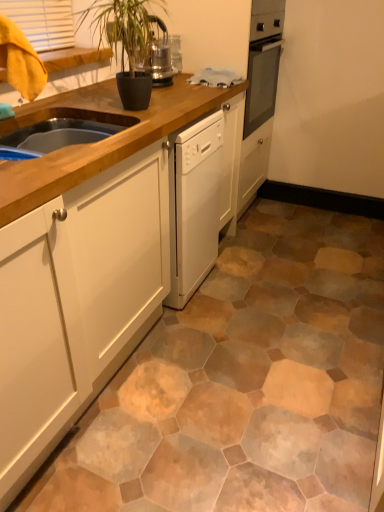
This screenshot has height=512, width=384. Find the location of `dark green glossy plant at upper center`. dark green glossy plant at upper center is located at coordinates (127, 31).

Describe the element at coordinates (127, 31) in the screenshot. The height and width of the screenshot is (512, 384). I see `dark green glossy plant at upper center` at that location.

The width and height of the screenshot is (384, 512). What are the coordinates of `white matte cabinet at center` in the screenshot? It's located at (82, 260).

Measure the distance between white matte cabinet at center and camera.

36.18 inches.

Describe the element at coordinates (82, 260) in the screenshot. This screenshot has width=384, height=512. I see `white matte cabinet at center` at that location.

The height and width of the screenshot is (512, 384). I want to click on dark green glossy plant at upper center, so click(127, 31).

Considering the relative positions of white matte cabinet at center and dark green glossy plant at upper center in the image provided, is white matte cabinet at center to the left or to the right of dark green glossy plant at upper center?

From the image, it's evident that white matte cabinet at center is to the left of dark green glossy plant at upper center.

Which object is further away from the camera, white matte cabinet at center or dark green glossy plant at upper center?

dark green glossy plant at upper center.

Is point (39, 418) farther from viewer compared to point (118, 7)?

No, (39, 418) is closer to viewer.

From the image's perspective, which is below, white matte cabinet at center or dark green glossy plant at upper center?

white matte cabinet at center.

From a real-world perspective, between white matte cabinet at center and dark green glossy plant at upper center, who is vertically higher?

dark green glossy plant at upper center is physically above.

Considering the sizes of white matte cabinet at center and dark green glossy plant at upper center in the image, is white matte cabinet at center wider or thinner than dark green glossy plant at upper center?

Clearly, white matte cabinet at center has more width compared to dark green glossy plant at upper center.

Between white matte cabinet at center and dark green glossy plant at upper center, which one has less height?

With less height is dark green glossy plant at upper center.

Considering the sizes of objects white matte cabinet at center and dark green glossy plant at upper center in the image provided, who is smaller, white matte cabinet at center or dark green glossy plant at upper center?

dark green glossy plant at upper center.

In the scene shown: Can we say white matte cabinet at center lies outside dark green glossy plant at upper center?

That's correct, white matte cabinet at center is outside of dark green glossy plant at upper center.

Are white matte cabinet at center and dark green glossy plant at upper center located far from each other?

That's not correct — white matte cabinet at center is a little close to dark green glossy plant at upper center.

Is white matte cabinet at center oriented towards dark green glossy plant at upper center?

No, white matte cabinet at center is not oriented towards dark green glossy plant at upper center.

How far apart are white matte cabinet at center and dark green glossy plant at upper center?

22.89 inches.

Find the location of a particular element. cabinetry that appears below the dark green glossy plant at upper center (from the image's perspective) is located at coordinates (82, 260).

Can you confirm if dark green glossy plant at upper center is positioned to the left of white matte cabinet at center?

Incorrect, dark green glossy plant at upper center is not on the left side of white matte cabinet at center.

Which object is further away from the camera, dark green glossy plant at upper center or white matte cabinet at center?

dark green glossy plant at upper center is behind.

Is point (163, 22) less distant than point (176, 93)?

That is False.

From the image's perspective, is dark green glossy plant at upper center located above white matte cabinet at center?

Indeed, from the image's perspective, dark green glossy plant at upper center is shown above white matte cabinet at center.

From a real-world perspective, which object stands above the other?

dark green glossy plant at upper center is physically above.

Considering the sizes of dark green glossy plant at upper center and white matte cabinet at center in the image, is dark green glossy plant at upper center wider or thinner than white matte cabinet at center?

Clearly, dark green glossy plant at upper center has less width compared to white matte cabinet at center.

From their relative heights in the image, would you say dark green glossy plant at upper center is taller or shorter than white matte cabinet at center?

dark green glossy plant at upper center is shorter than white matte cabinet at center.

Between dark green glossy plant at upper center and white matte cabinet at center, which one has smaller size?

Smaller between the two is dark green glossy plant at upper center.

Is dark green glossy plant at upper center completely or partially outside of white matte cabinet at center?

Yes.

Is dark green glossy plant at upper center not near white matte cabinet at center?

dark green glossy plant at upper center is near white matte cabinet at center, not far away.

Could you tell me if dark green glossy plant at upper center is facing white matte cabinet at center?

No.

What's the angular difference between dark green glossy plant at upper center and white matte cabinet at center's facing directions?

dark green glossy plant at upper center and white matte cabinet at center are facing 0.00111 degrees away from each other.

The image size is (384, 512). Identify the location of cabinetry in front of the dark green glossy plant at upper center. (82, 260).

What are the coordinates of `cabinetry below the dark green glossy plant at upper center (from the image's perspective)` in the screenshot? It's located at (82, 260).

The image size is (384, 512). I want to click on plant above the white matte cabinet at center (from a real-world perspective), so click(x=127, y=31).